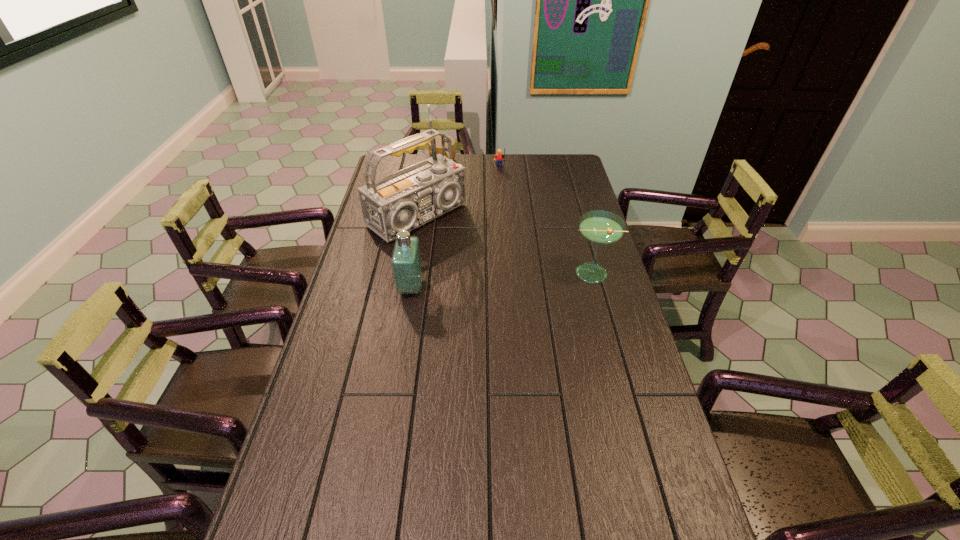
You are a GUI agent. You are given a task and a screenshot of the screen. Output one action in this format:
    pyautogui.click(x=<x>, y=<y>)
    Task: Click on the mug situated at the far edge
    The height and width of the screenshot is (540, 960).
    Given the screenshot: What is the action you would take?
    pyautogui.click(x=438, y=138)

Where is `object that is at the left edge`? The width and height of the screenshot is (960, 540). object that is at the left edge is located at coordinates (407, 199).

Find the location of `object positioned at the right edge`. object positioned at the right edge is located at coordinates (599, 227).

At what (x,y) coordinates should I click in order to perform the action: click on vacant area at the far edge. Please return your answer as a coordinate pair (x, y). This screenshot has height=540, width=960. Looking at the image, I should click on (517, 166).

Where is `vacant region at the near edge of the desktop`? Image resolution: width=960 pixels, height=540 pixels. vacant region at the near edge of the desktop is located at coordinates (444, 518).

In order to click on vacant area at the left edge in this screenshot , I will do `click(333, 350)`.

What are the coordinates of `vacant region at the right edge of the desktop` in the screenshot? It's located at (621, 390).

At what (x,y) coordinates should I click in order to perform the action: click on vacant space at the far left corner. Please return your answer as a coordinate pair (x, y). This screenshot has height=540, width=960. Looking at the image, I should click on pyautogui.click(x=382, y=163).

The width and height of the screenshot is (960, 540). In the image, there is a desktop. In order to click on free region at the far right corner in this screenshot , I will do `click(569, 163)`.

At what (x,y) coordinates should I click in order to perform the action: click on vacant position at the near right corner of the desktop. Please return your answer as a coordinate pair (x, y). This screenshot has height=540, width=960. Looking at the image, I should click on (665, 524).